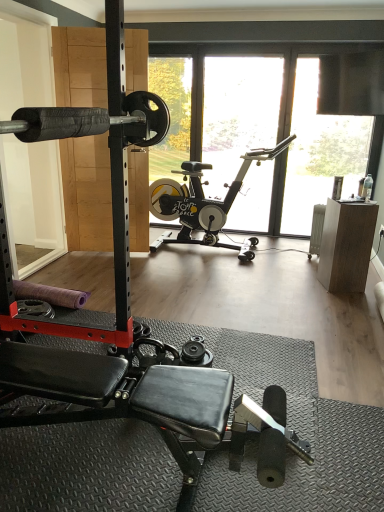
Question: Considering the positions of black rubber barbell at left and black rubber stationary bicycle at center in the image, is black rubber barbell at left bigger or smaller than black rubber stationary bicycle at center?

Choices:
 (A) big
 (B) small

Answer: (B)

Question: From a real-world perspective, is black rubber barbell at left positioned above or below black rubber stationary bicycle at center?

Choices:
 (A) below
 (B) above

Answer: (B)

Question: Considering the real-world distances, which object is farthest from the black rubber barbell at left?

Choices:
 (A) black rubber dumbbell at center
 (B) transparent glass window at upper center
 (C) black rubber stationary bicycle at center

Answer: (B)

Question: Which is farther from the black rubber dumbbell at center?

Choices:
 (A) black rubber stationary bicycle at center
 (B) black rubber barbell at left
 (C) transparent glass window at upper center

Answer: (C)